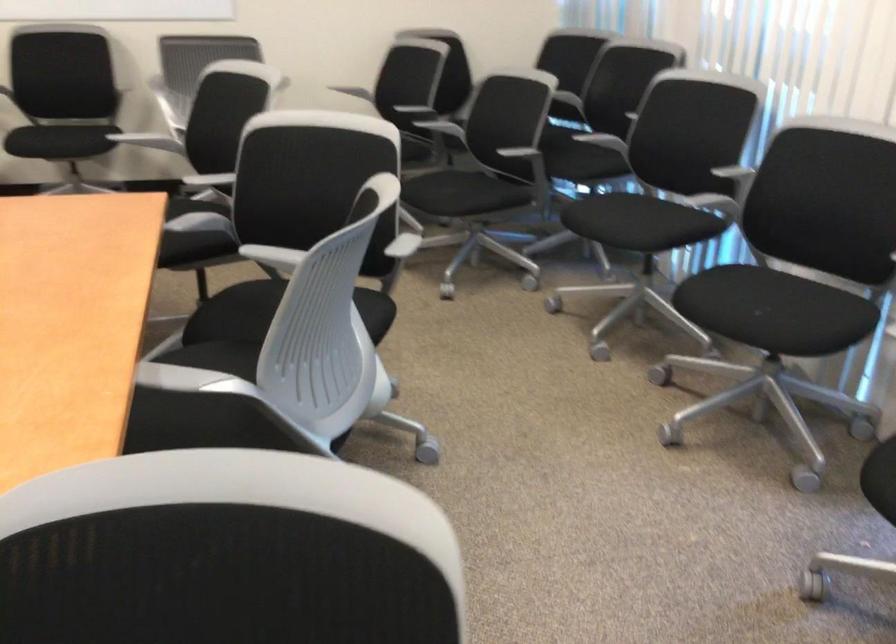
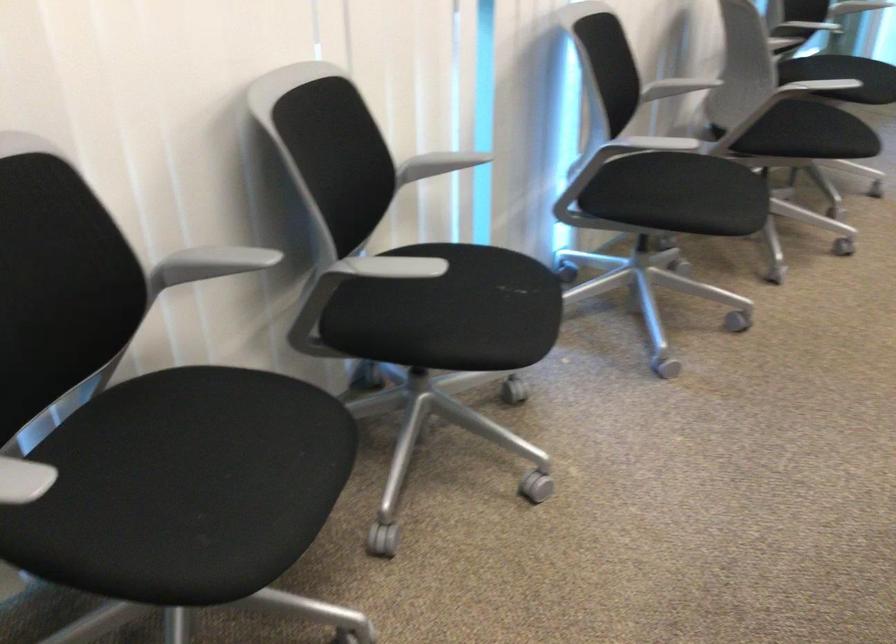
Question: I am providing you with two images of the same scene from different viewpoints. Please identify which objects are invisible in image2.

Choices:
 (A) black handle screwdriver
 (B) black chair sitting surface
 (C) grey chair armrest
 (D) chair sitting surface

Answer: (D)